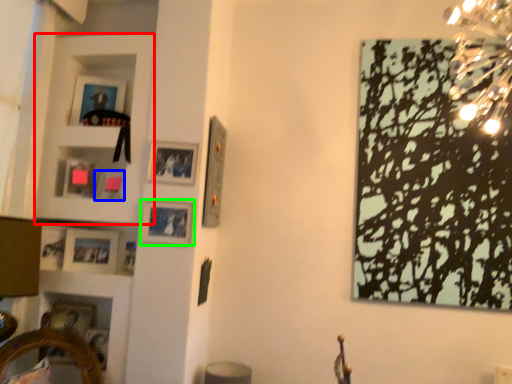
Question: Which object is the closest to the cabinet (highlighted by a red box)? Choose among these: picture frame (highlighted by a blue box) or picture frame (highlighted by a green box).

Choices:
 (A) picture frame
 (B) picture frame

Answer: (A)